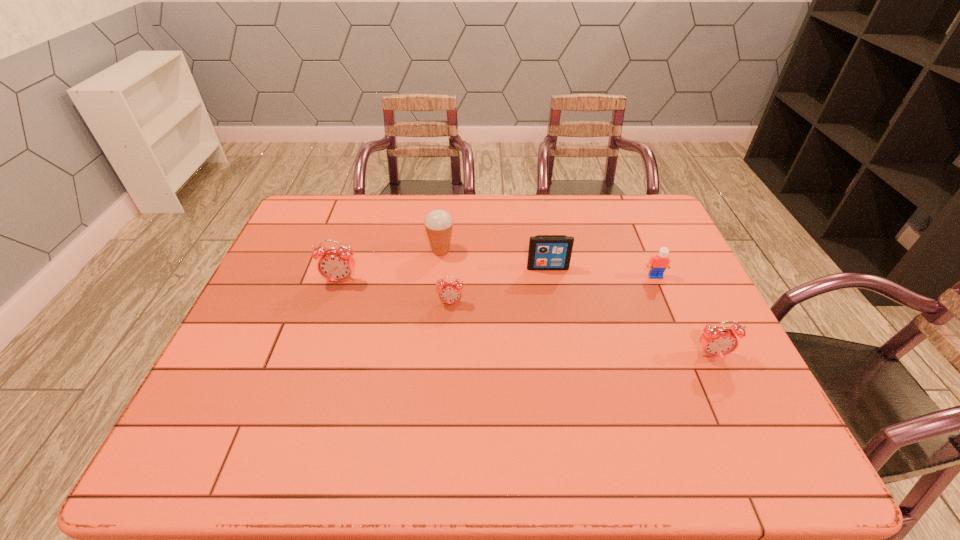
This screenshot has width=960, height=540. What are the coordinates of `blank space at the left edge` in the screenshot? It's located at (244, 339).

Image resolution: width=960 pixels, height=540 pixels. In order to click on free space at the right edge in this screenshot , I will do (653, 309).

Locate an element on the screen. Image resolution: width=960 pixels, height=540 pixels. free space at the far right corner of the desktop is located at coordinates (651, 215).

Identify the location of free space between the second alarm clock from right to left and the tallest alarm clock. (396, 292).

Where is `empty space that is in between the leftmost alarm clock and the farthest object`? This screenshot has width=960, height=540. empty space that is in between the leftmost alarm clock and the farthest object is located at coordinates (391, 266).

The width and height of the screenshot is (960, 540). Identify the location of vacant area between the Lego and the leftmost object. (498, 279).

I want to click on vacant space that is in between the second alarm clock from left to right and the tallest alarm clock, so tap(396, 292).

Identify the location of blank region between the third object from right to left and the Lego. (602, 272).

Identify the location of vacant space in between the Lego and the second alarm clock from right to left. (553, 289).

The height and width of the screenshot is (540, 960). Identify the location of empty space that is in between the farthest object and the tallest alarm clock. (391, 266).